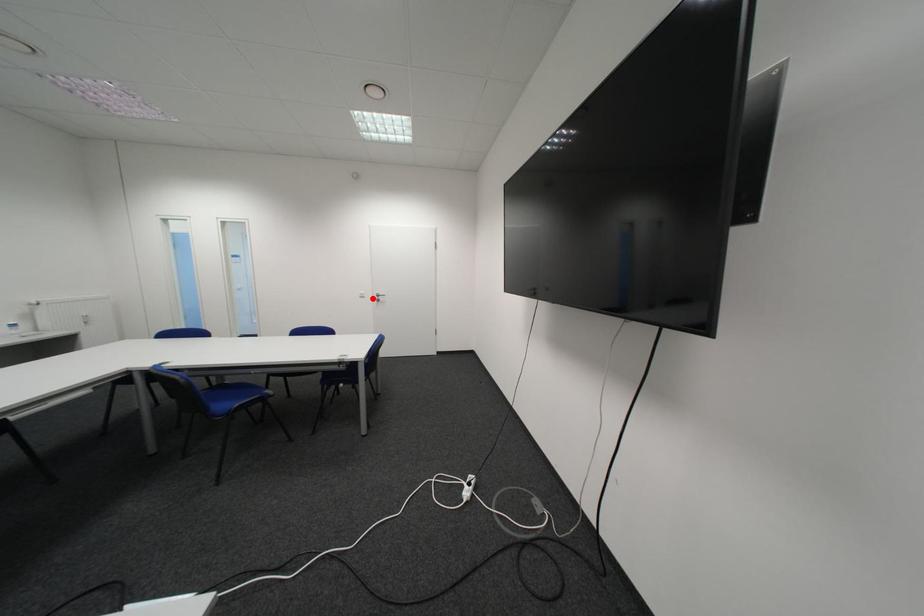
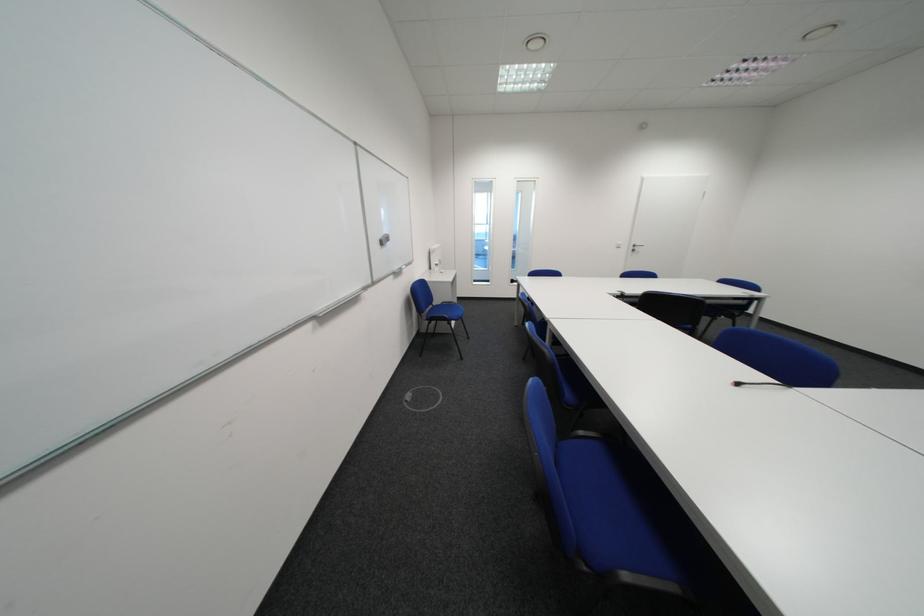
In the second image, find the point that corresponds to the highlighted location in the first image.

(628, 249)